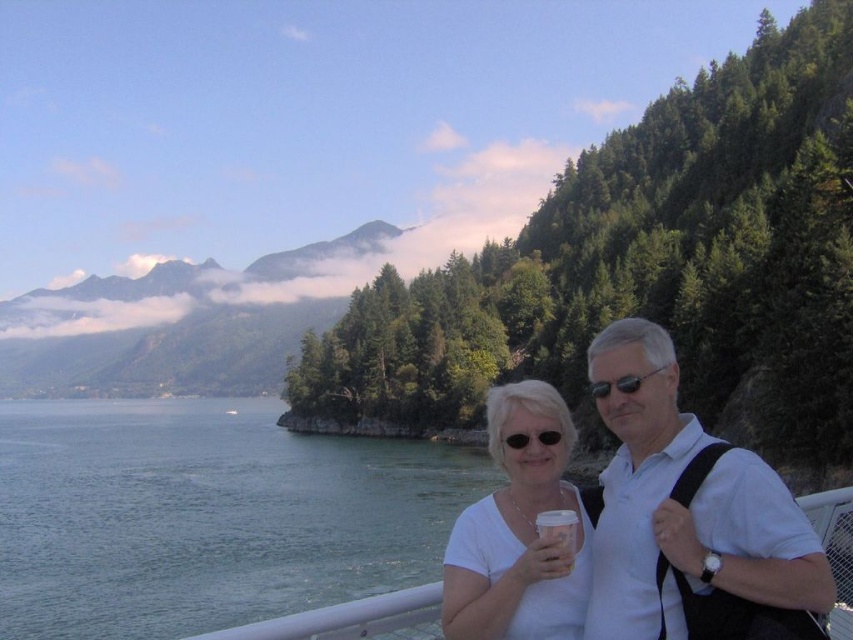
Question: Among these points, which one is nearest to the camera?

Choices:
 (A) (463, 513)
 (B) (141, 493)

Answer: (A)

Question: Which point is farther to the camera?

Choices:
 (A) (624, 384)
 (B) (728, 513)
 (C) (512, 634)

Answer: (A)

Question: From the image, what is the correct spatial relationship of blue water at lower left in relation to white matte shirt at right?

Choices:
 (A) above
 (B) below

Answer: (B)

Question: Which point is closer to the camera?

Choices:
 (A) blue water at lower left
 (B) black reflective sunglasses at upper right
 (C) white matte shirt at right

Answer: (C)

Question: Does white matte shirt at center have a smaller size compared to white paper cup at center?

Choices:
 (A) yes
 (B) no

Answer: (B)

Question: Is blue water at lower left wider than white matte shirt at center?

Choices:
 (A) yes
 (B) no

Answer: (A)